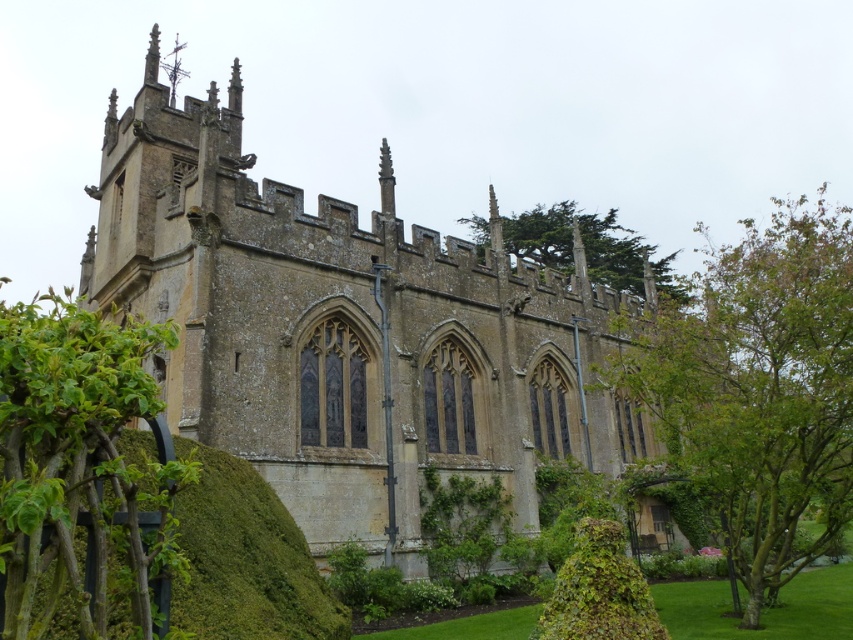
You are standing in front of the historic stone building and want to take a photo of both the green mossy hedge at lower left and the green leafy tree at upper center. Which object should you adjust your camera angle to include first if you want to capture both in the frame?

The green mossy hedge at lower left is positioned on the left side of the green leafy tree at upper center, so you should adjust your camera angle to include the green mossy hedge at lower left first as it is on the left side of the tree.

You are standing at the center of the garden in front of the historic stone building. You want to place a new decorative statue that is 1.2 meters wide. The statue needs to be placed in an area that is not occupied by any existing objects. Is there enough space between the green mossy hedge at lower left and the edge of the garden to accommodate the statue?

The green mossy hedge at lower left is located at point [247,557]. Since the statue requires 1.2 meters of space and the hedge is positioned at that coordinate, there might be sufficient space between the hedge and the garden edge, but the exact distance isn